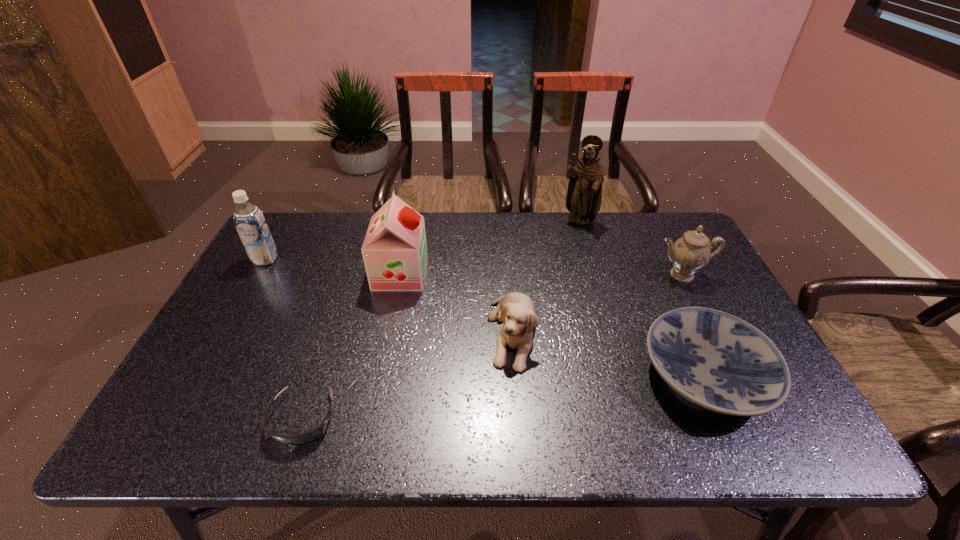
This screenshot has width=960, height=540. In order to click on object located in the left edge section of the desktop in this screenshot , I will do `click(251, 225)`.

Locate an element on the screen. This screenshot has width=960, height=540. chinaware that is at the right edge is located at coordinates (690, 253).

Find the location of a particular element. plate located in the right edge section of the desktop is located at coordinates (718, 361).

This screenshot has height=540, width=960. What are the coordinates of `object present at the far left corner` in the screenshot? It's located at (251, 225).

The height and width of the screenshot is (540, 960). I want to click on object that is at the near right corner, so click(718, 361).

In the image, there is a desktop. Find the location of `vacant space at the far edge`. vacant space at the far edge is located at coordinates (635, 228).

In the image, there is a desktop. Identify the location of vacant space at the near edge. The image size is (960, 540). (707, 418).

Find the location of a particular element. vacant space at the left edge is located at coordinates (236, 309).

Where is `free location at the right edge`? free location at the right edge is located at coordinates (713, 295).

Find the location of a particular element. vacant area at the far left corner of the desktop is located at coordinates (316, 239).